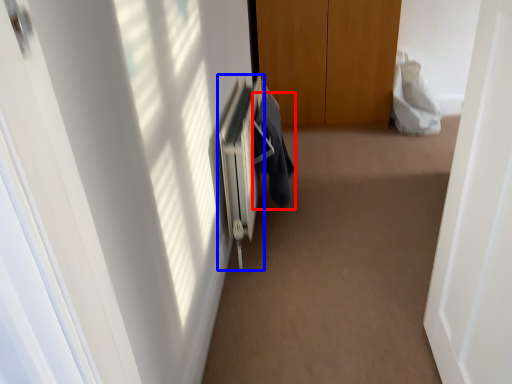
Question: Which point is closer to the camera, robe (highlighted by a red box) or radiator (highlighted by a blue box)?

Choices:
 (A) robe
 (B) radiator

Answer: (B)